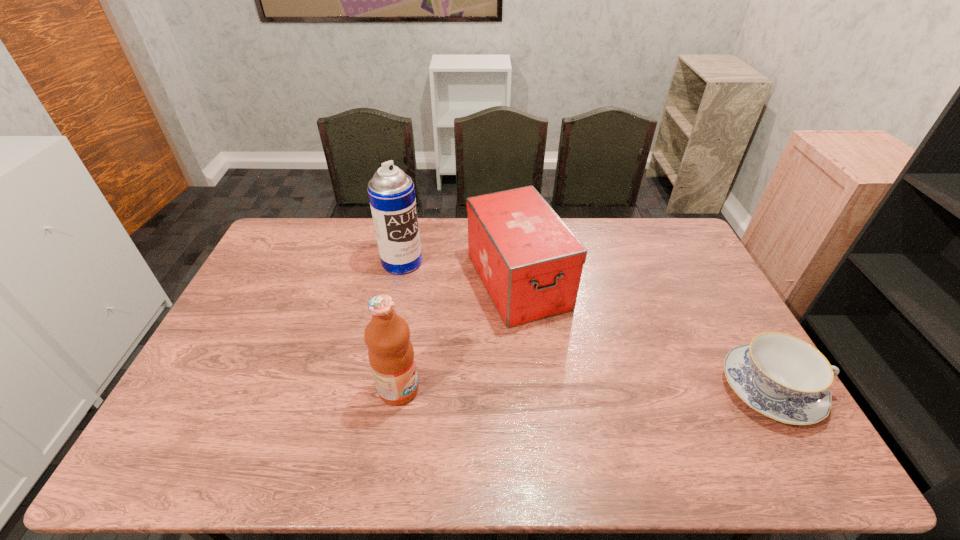
Find the location of a particular element. The height and width of the screenshot is (540, 960). vacant space positioned on the handle side of the second object from right to left is located at coordinates (569, 373).

This screenshot has height=540, width=960. What are the coordinates of `vacant area situated 0.170m on the handle side of the second object from right to left` in the screenshot? It's located at (567, 370).

At what (x,y) coordinates should I click in order to perform the action: click on vacant space located 0.270m on the handle side of the second object from right to left. Please return your answer as a coordinate pair (x, y). Image resolution: width=960 pixels, height=540 pixels. Looking at the image, I should click on (585, 399).

This screenshot has width=960, height=540. Find the location of `aerosol can located in the far edge section of the desktop`. aerosol can located in the far edge section of the desktop is located at coordinates point(391,192).

The width and height of the screenshot is (960, 540). In order to click on the first-aid kit that is at the far edge in this screenshot , I will do `click(530, 262)`.

Locate an element on the screen. The image size is (960, 540). fruit juice located in the near edge section of the desktop is located at coordinates (391, 355).

Locate an element on the screen. The image size is (960, 540). chinaware present at the near edge is located at coordinates (783, 377).

Find the location of a particular element. Image resolution: width=960 pixels, height=540 pixels. object located at the right edge is located at coordinates (x=783, y=377).

At what (x,y) coordinates should I click in order to perform the action: click on object that is at the near right corner. Please return your answer as a coordinate pair (x, y). Looking at the image, I should click on (783, 377).

I want to click on vacant space at the far edge of the desktop, so click(x=464, y=242).